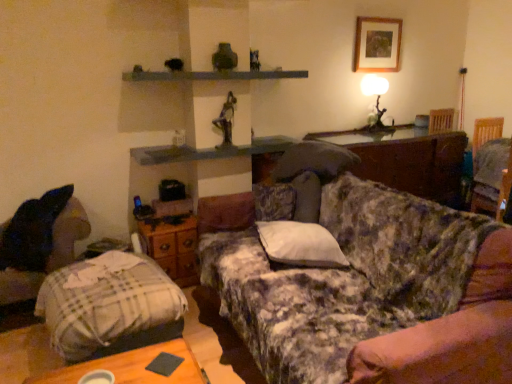
Question: Considering the positions of wooden table at center and dark fabric swivel chair at lower left, which appears as the 1th swivel chair when viewed from the front, in the image, is wooden table at center wider or thinner than dark fabric swivel chair at lower left, which appears as the 1th swivel chair when viewed from the front,?

Choices:
 (A) wide
 (B) thin

Answer: (A)

Question: From the image's perspective, is wooden table at center positioned above or below dark fabric swivel chair at lower left, acting as the first swivel chair starting from the bottom?

Choices:
 (A) above
 (B) below

Answer: (A)

Question: Which is farther from the wooden drawer at center?

Choices:
 (A) dark wood swivel chair at right, the first swivel chair viewed from the top
 (B) floral fabric couch at center
 (C) dark fabric swivel chair at lower left, acting as the first swivel chair starting from the left
 (D) metallic gray shelf at upper center
 (E) wooden picture frame at upper right

Answer: (A)

Question: Which object is positioned closest to the dark fabric swivel chair at lower left, acting as the first swivel chair starting from the left?

Choices:
 (A) plaid fabric bedcover at lower left
 (B) white soft pillow at center, marked as the first pillow in a bottom-to-top arrangement
 (C) wooden drawer at center
 (D) wooden table at center
 (E) floral fabric couch at center

Answer: (A)